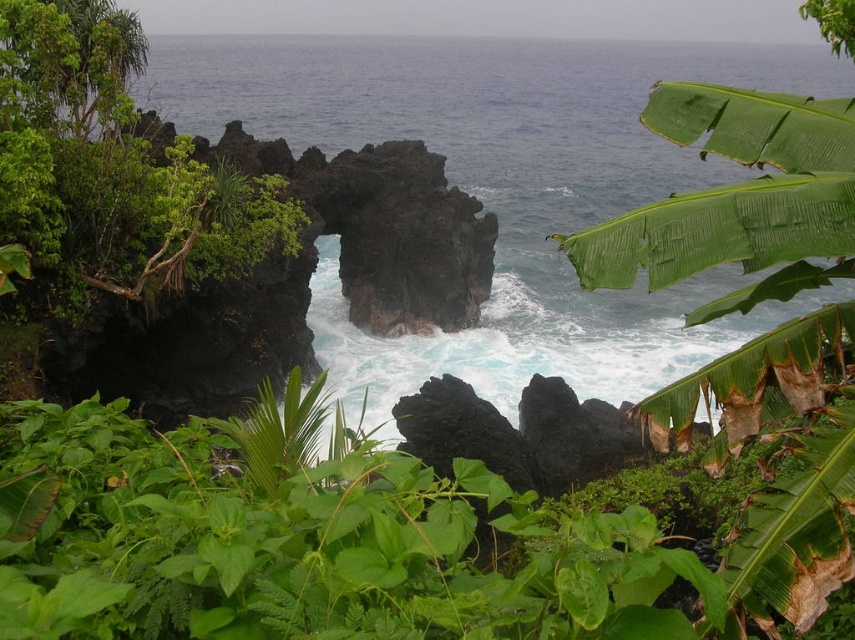
Does blue water at center have a smaller size compared to green leafy banana tree at right?

No.

This screenshot has height=640, width=855. I want to click on blue water at center, so click(x=502, y=189).

The height and width of the screenshot is (640, 855). Identify the location of blue water at center. (502, 189).

Which is behind, point (652, 273) or point (16, 64)?

Positioned behind is point (16, 64).

Who is taller, green leafy banana tree at right or green leafy shrub at left?

With more height is green leafy banana tree at right.

What do you see at coordinates (736, 198) in the screenshot? Image resolution: width=855 pixels, height=640 pixels. I see `green leafy banana tree at right` at bounding box center [736, 198].

Find the location of a particular element. The image size is (855, 640). green leafy banana tree at right is located at coordinates (736, 198).

Is blue water at center to the right of green leafy shrub at left from the viewer's perspective?

In fact, blue water at center is to the left of green leafy shrub at left.

Based on the photo, who is more distant from viewer, [293,54] or [55,29]?

The point [293,54] is more distant.

The height and width of the screenshot is (640, 855). I want to click on blue water at center, so click(502, 189).